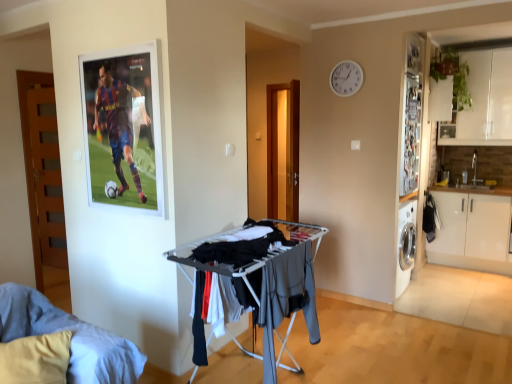
Question: In terms of height, does wooden door at left look taller or shorter compared to white plastic clock at upper center?

Choices:
 (A) short
 (B) tall

Answer: (B)

Question: In the image, is wooden door at left positioned in front of or behind white plastic clock at upper center?

Choices:
 (A) front
 (B) behind

Answer: (B)

Question: Estimate the real-world distances between objects in this image. Which object is farther from the wooden door at left?

Choices:
 (A) light blue fabric bed at lower left
 (B) dark gray fabric drying rack at center
 (C) white matte cabinet at right
 (D) white plastic clock at upper center

Answer: (C)

Question: Estimate the real-world distances between objects in this image. Which object is closer to the light blue fabric bed at lower left?

Choices:
 (A) wooden door at left
 (B) dark gray fabric drying rack at center
 (C) white plastic clock at upper center
 (D) white matte cabinet at right

Answer: (B)